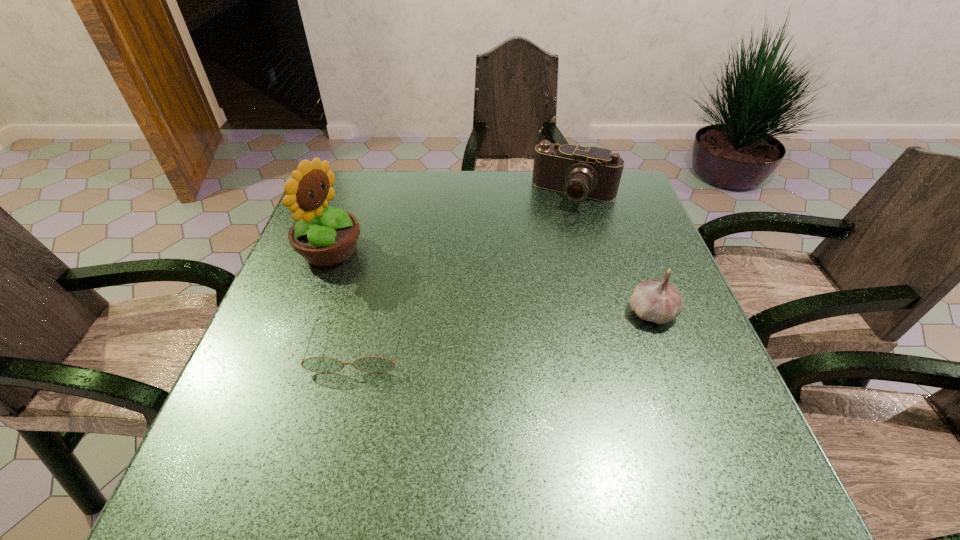
This screenshot has height=540, width=960. In order to click on vacant area situated on the face of the sunflower in this screenshot , I will do `click(374, 265)`.

Where is `vacant space positioned on the face of the sunflower`? Image resolution: width=960 pixels, height=540 pixels. vacant space positioned on the face of the sunflower is located at coordinates (488, 302).

Where is `vacant space located 0.120m on the face of the sunflower`? The width and height of the screenshot is (960, 540). vacant space located 0.120m on the face of the sunflower is located at coordinates (399, 273).

Where is `object present at the far edge`? Image resolution: width=960 pixels, height=540 pixels. object present at the far edge is located at coordinates (579, 172).

The width and height of the screenshot is (960, 540). What are the coordinates of `sunglasses present at the left edge` in the screenshot? It's located at (315, 364).

In order to click on sunflower positioned at the left edge in this screenshot , I will do `click(324, 236)`.

The height and width of the screenshot is (540, 960). What are the coordinates of `garlic located at the right edge` in the screenshot? It's located at (658, 301).

The image size is (960, 540). In order to click on camera at the right edge in this screenshot , I will do `click(579, 172)`.

At what (x,y) coordinates should I click in order to perform the action: click on object located in the far right corner section of the desktop. Please return your answer as a coordinate pair (x, y). Image resolution: width=960 pixels, height=540 pixels. Looking at the image, I should click on (579, 172).

The height and width of the screenshot is (540, 960). In order to click on vacant space at the far edge of the desktop in this screenshot , I will do `click(449, 179)`.